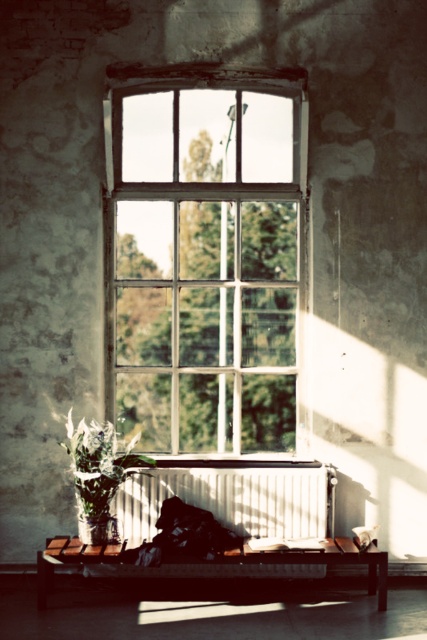
Question: Can you confirm if wooden bench at center is thinner than green matte plant at lower left?

Choices:
 (A) no
 (B) yes

Answer: (A)

Question: In this image, where is wooden bench at center located relative to green matte plant at lower left?

Choices:
 (A) right
 (B) left

Answer: (A)

Question: Which point is closer to the camera?

Choices:
 (A) velvety black pillow at lower right
 (B) green matte plant at lower left

Answer: (A)

Question: Can you confirm if clear glass window at center is positioned above green matte plant at lower left?

Choices:
 (A) no
 (B) yes

Answer: (B)

Question: Which object is positioned closest to the wooden bench at center?

Choices:
 (A) velvety black pillow at lower right
 (B) green matte plant at lower left
 (C) clear glass window at center

Answer: (A)

Question: Which object is closer to the camera taking this photo?

Choices:
 (A) velvety black pillow at lower right
 (B) clear glass window at center
 (C) green matte plant at lower left

Answer: (A)